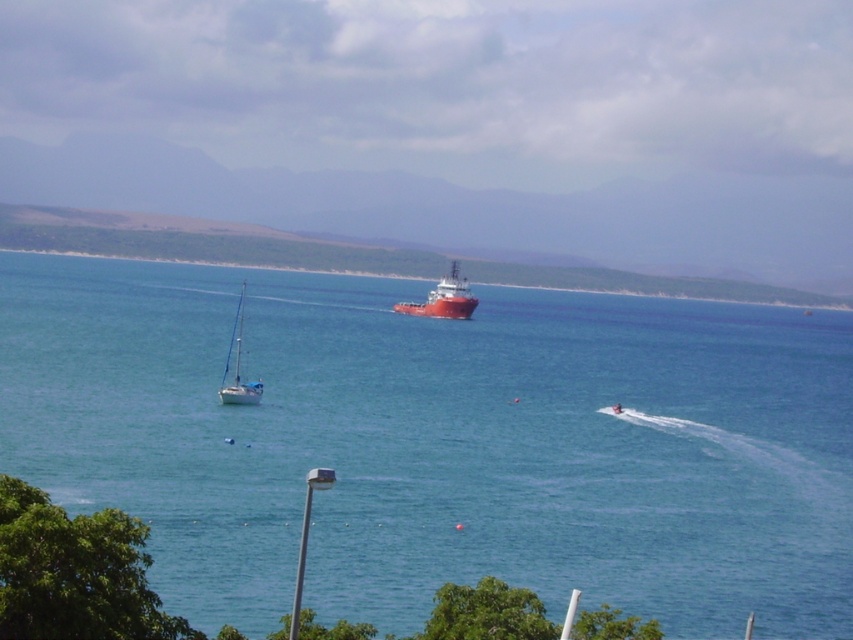
Is blue water at center wider than red matte ship at center?

Yes, blue water at center is wider than red matte ship at center.

Can you confirm if blue water at center is shorter than red matte ship at center?

No, blue water at center is not shorter than red matte ship at center.

Image resolution: width=853 pixels, height=640 pixels. Find the location of `blue water at center`. blue water at center is located at coordinates (440, 444).

This screenshot has width=853, height=640. I want to click on blue water at center, so click(440, 444).

Who is taller, red matte ship at center or white glossy sailboat at lower left?

With more height is white glossy sailboat at lower left.

Does point (463, 285) come farther from viewer compared to point (247, 385)?

That is True.

This screenshot has height=640, width=853. Identify the location of red matte ship at center. (444, 298).

Does blue water at center have a lesser width compared to white glossy sailboat at lower left?

In fact, blue water at center might be wider than white glossy sailboat at lower left.

Can you confirm if blue water at center is shorter than white glossy sailboat at lower left?

In fact, blue water at center may be taller than white glossy sailboat at lower left.

Find the location of a particular element. This screenshot has width=853, height=640. blue water at center is located at coordinates (440, 444).